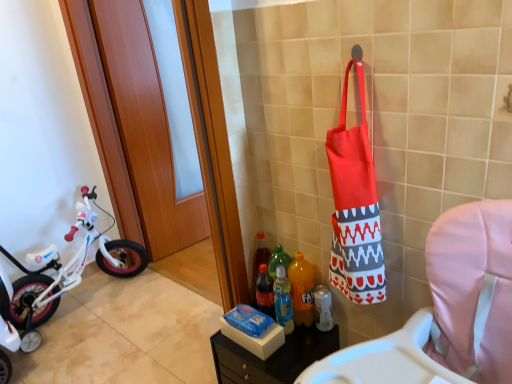
At what (x,y) coordinates should I click in order to perform the action: click on vacant space in front of translucent plastic bottle at lower center, acting as the first bottle starting from the left. Please return your answer as a coordinate pair (x, y). The height and width of the screenshot is (384, 512). Looking at the image, I should click on (294, 346).